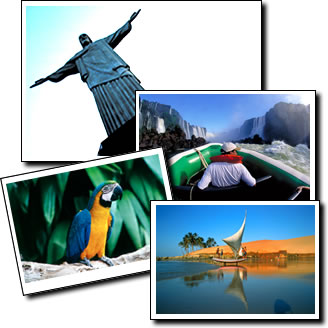
You are a GUI agent. You are given a task and a screenshot of the screen. Output one action in this format:
    pyautogui.click(x=<x>, y=<y>)
    Task: Click on the pictures
    
    Given the screenshot: What is the action you would take?
    pyautogui.click(x=109, y=221), pyautogui.click(x=99, y=110), pyautogui.click(x=203, y=141), pyautogui.click(x=200, y=237)